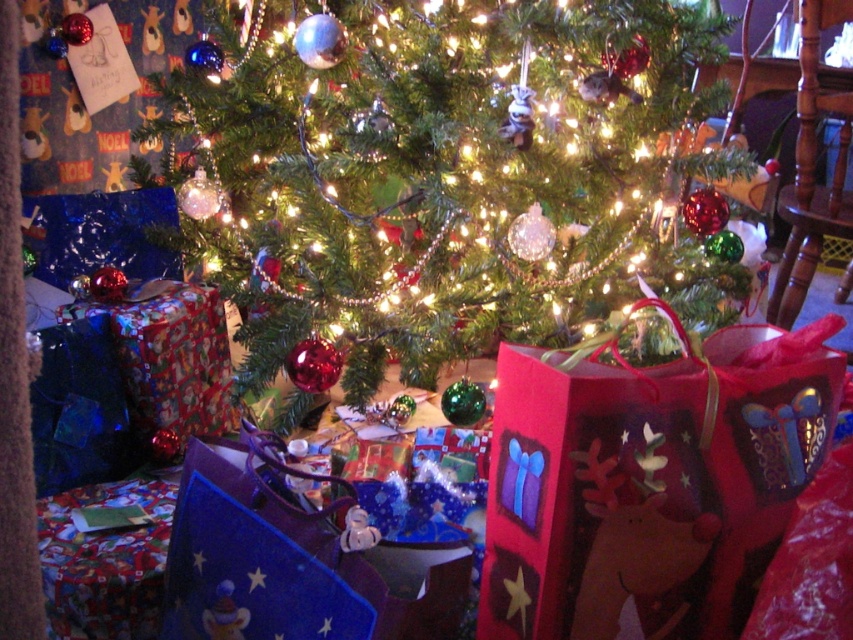
Question: Does shiny metallic ornaments at center lie behind red paper bag with reindeer design at lower right?

Choices:
 (A) yes
 (B) no

Answer: (A)

Question: Which point appears farthest from the camera in this image?

Choices:
 (A) tap(293, 250)
 (B) tap(529, 577)

Answer: (A)

Question: From the image, what is the correct spatial relationship of shiny metallic ornaments at center in relation to red paper bag with reindeer design at lower right?

Choices:
 (A) above
 (B) below

Answer: (A)

Question: In this image, where is shiny metallic ornaments at center located relative to red paper bag with reindeer design at lower right?

Choices:
 (A) above
 (B) below

Answer: (A)

Question: Which object is farther from the camera taking this photo?

Choices:
 (A) shiny metallic ornaments at center
 (B) red paper bag with reindeer design at lower right

Answer: (A)